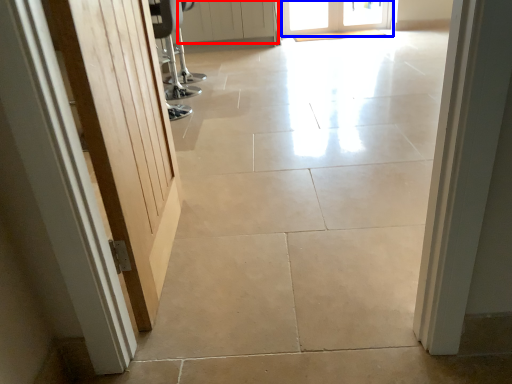
Question: Which of the following is the farthest to the observer, door (highlighted by a red box) or door (highlighted by a blue box)?

Choices:
 (A) door
 (B) door

Answer: (B)